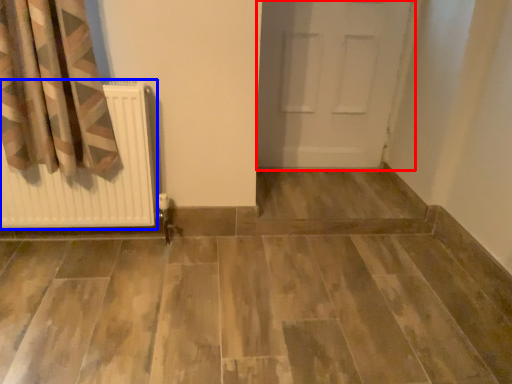
Question: Among these objects, which one is nearest to the camera, door (highlighted by a red box) or radiator (highlighted by a blue box)?

Choices:
 (A) door
 (B) radiator

Answer: (B)